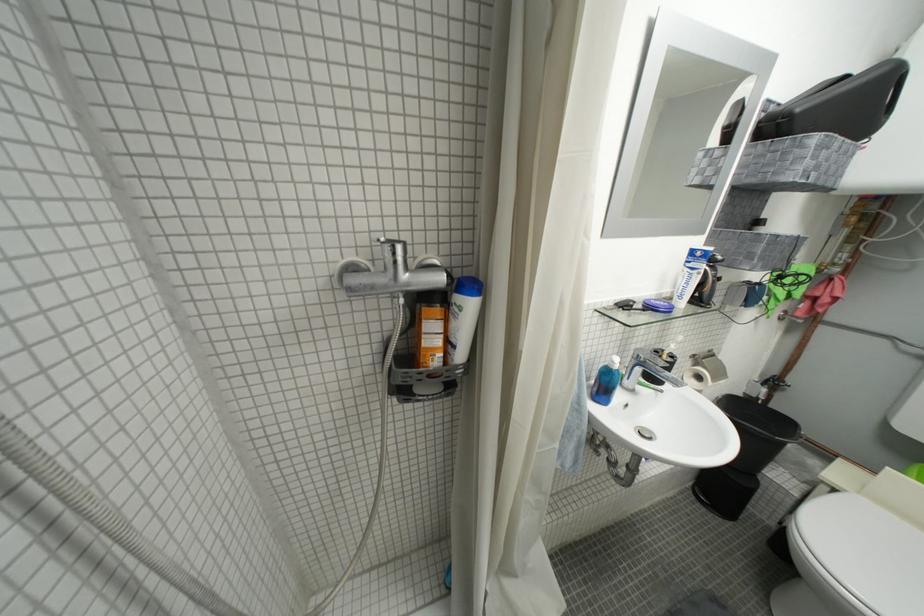
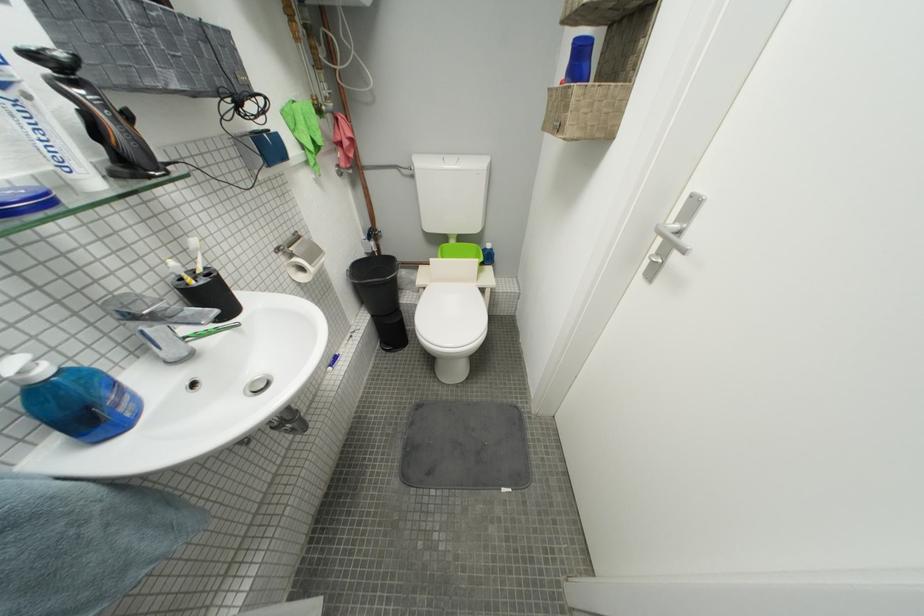
Find the pixel in the second image that matches point 626,369 in the first image.

(53, 374)